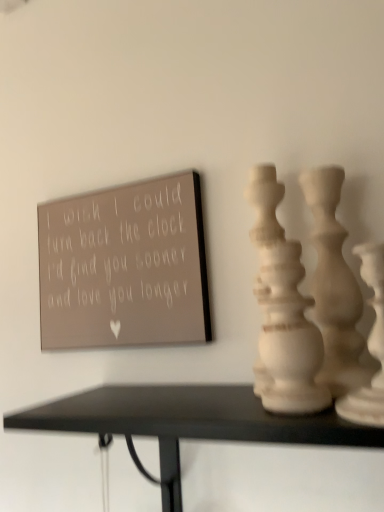
Question: Which direction should I rotate to look at white matte vase at center, which is the second vase from back to front, — up or down?

Choices:
 (A) up
 (B) down

Answer: (B)

Question: Does white matte vase at right, which is the first vase in back-to-front order, have a larger size compared to white matte vase at right, the first vase when ordered from front to back?

Choices:
 (A) yes
 (B) no

Answer: (B)

Question: Can you confirm if white matte vase at right, the third vase when ordered from front to back, is positioned to the right of white matte vase at right, acting as the third vase starting from the back?

Choices:
 (A) no
 (B) yes

Answer: (A)

Question: Is white matte vase at right, the third vase when ordered from front to back, positioned behind white matte vase at right, the first vase when ordered from front to back?

Choices:
 (A) no
 (B) yes

Answer: (B)

Question: Is white matte vase at right, the third vase when ordered from front to back, taller than white matte vase at right, the first vase when ordered from front to back?

Choices:
 (A) no
 (B) yes

Answer: (B)

Question: From the image's perspective, does white matte vase at right, which is the first vase in back-to-front order, appear lower than white matte vase at right, acting as the third vase starting from the back?

Choices:
 (A) yes
 (B) no

Answer: (B)

Question: Is white matte vase at right, which is the first vase in back-to-front order, far away from white matte vase at right, acting as the third vase starting from the back?

Choices:
 (A) no
 (B) yes

Answer: (A)

Question: Is matte gray sign at upper left oriented away from white matte vase at right, the first vase when ordered from front to back?

Choices:
 (A) no
 (B) yes

Answer: (A)

Question: From the image's perspective, is matte gray sign at upper left over white matte vase at right, acting as the third vase starting from the back?

Choices:
 (A) yes
 (B) no

Answer: (A)

Question: Is matte gray sign at upper left at the left side of white matte vase at right, acting as the third vase starting from the back?

Choices:
 (A) no
 (B) yes

Answer: (B)

Question: Can you confirm if matte gray sign at upper left is smaller than white matte vase at right, the first vase when ordered from front to back?

Choices:
 (A) yes
 (B) no

Answer: (B)

Question: Does matte gray sign at upper left have a lesser height compared to white matte vase at right, acting as the third vase starting from the back?

Choices:
 (A) no
 (B) yes

Answer: (A)

Question: From the image's perspective, is matte gray sign at upper left under white matte vase at right, the first vase when ordered from front to back?

Choices:
 (A) no
 (B) yes

Answer: (A)

Question: Can you confirm if white matte vase at center, arranged as the second vase when viewed from the front, is wider than white matte vase at right, the first vase when ordered from front to back?

Choices:
 (A) no
 (B) yes

Answer: (A)